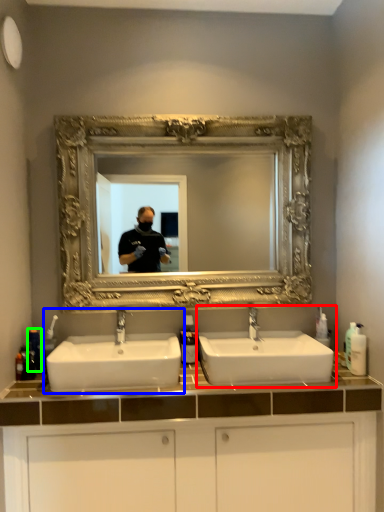
Question: Considering the real-world distances, which object is farthest from sink (highlighted by a red box)? sink (highlighted by a blue box) or toiletry (highlighted by a green box)?

Choices:
 (A) sink
 (B) toiletry

Answer: (B)